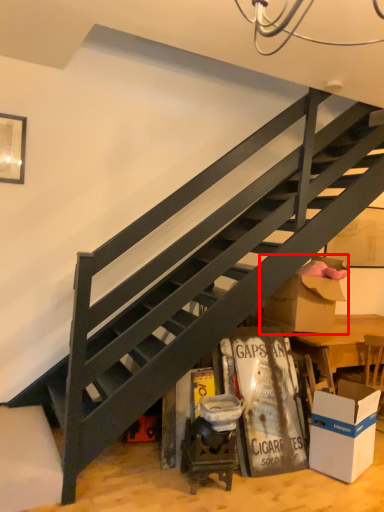
Question: Where is cardboard box (annotated by the red box) located in relation to box in the image?

Choices:
 (A) right
 (B) left

Answer: (B)